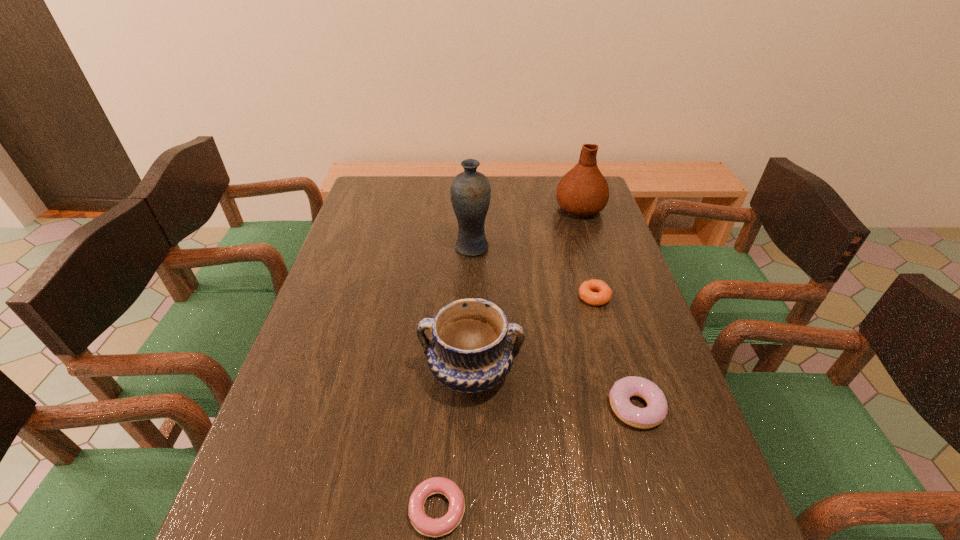
Choose which object is the nearest neighbor to the leftmost doughnut. Please provide its 2D coordinates. Your answer should be formatted as a tuple, i.e. [(x, y)], where the tuple contains the x and y coordinates of a point satisfying the conditions above.

[(470, 351)]

Identify which object is located as the nearest to the fourth nearest object. Please provide its 2D coordinates. Your answer should be formatted as a tuple, i.e. [(x, y)], where the tuple contains the x and y coordinates of a point satisfying the conditions above.

[(470, 351)]

Where is `doughnut object that ranks as the second closest to the shortest doughnut`? doughnut object that ranks as the second closest to the shortest doughnut is located at coordinates (595, 292).

The width and height of the screenshot is (960, 540). Identify the location of doughnut that is the second closest to the second farthest doughnut. coord(425,525).

Find the location of a particular element. The height and width of the screenshot is (540, 960). blank space that satisfies the following two spatial constraints: 1. on the front side of the fifth nearest object; 2. on the left side of the second nearest doughnut is located at coordinates (468, 408).